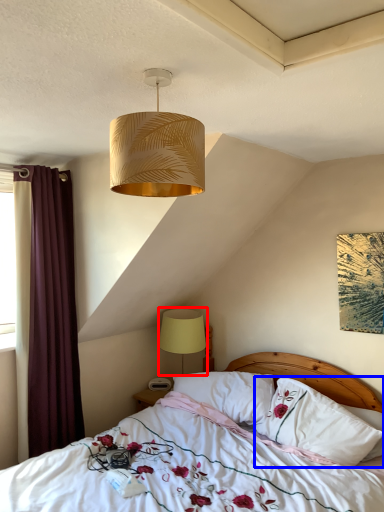
Question: Which point is further to the camera, lamp (highlighted by a red box) or pillow (highlighted by a blue box)?

Choices:
 (A) lamp
 (B) pillow

Answer: (A)